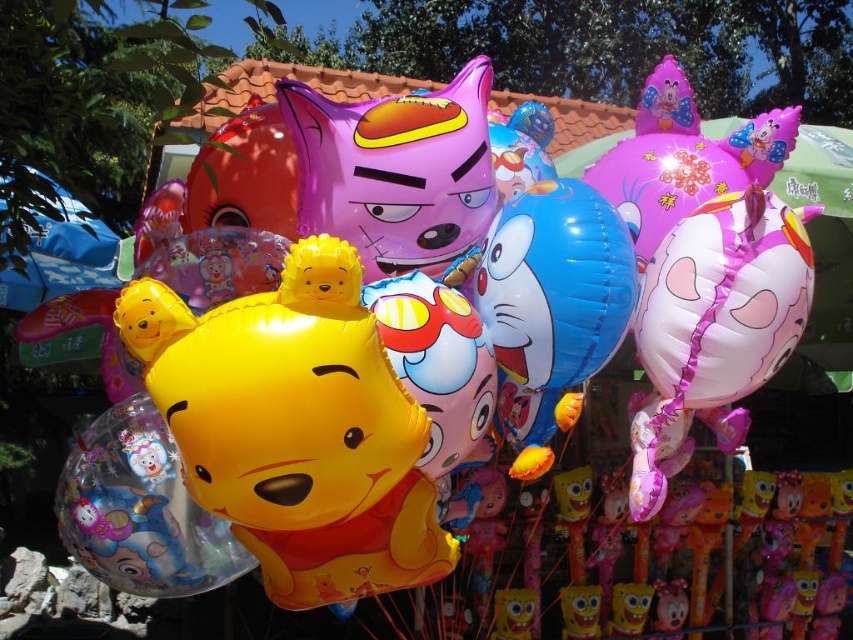
Question: Estimate the real-world distances between objects in this image. Which object is closer to the yellow matte winnie the pooh balloon at center?

Choices:
 (A) purple glossy balloon at center
 (B) pink glossy pig at upper right

Answer: (A)

Question: Observing the image, what is the correct spatial positioning of yellow matte winnie the pooh balloon at center in reference to purple glossy balloon at center?

Choices:
 (A) below
 (B) above

Answer: (A)

Question: Is yellow matte winnie the pooh balloon at center closer to the viewer compared to blue glossy balloon at center?

Choices:
 (A) yes
 (B) no

Answer: (A)

Question: Which is farther from the pink glossy pig at upper right?

Choices:
 (A) blue glossy balloon at center
 (B) yellow matte winnie the pooh balloon at center

Answer: (B)

Question: Is pink glossy pig at upper right to the right of blue glossy balloon at center from the viewer's perspective?

Choices:
 (A) no
 (B) yes

Answer: (B)

Question: Estimate the real-world distances between objects in this image. Which object is farther from the purple glossy balloon at center?

Choices:
 (A) blue glossy balloon at center
 (B) yellow matte winnie the pooh balloon at center
 (C) pink glossy pig at upper right

Answer: (C)